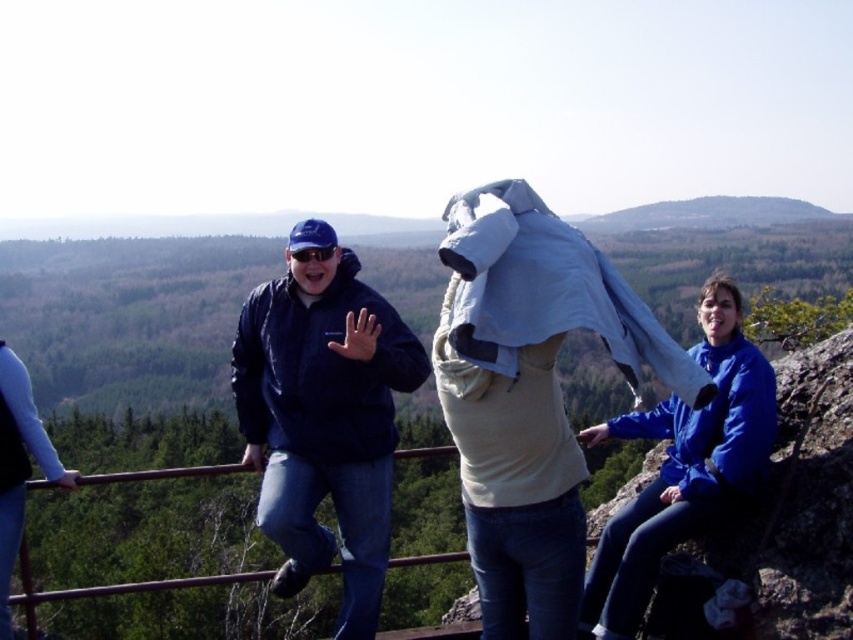
Question: Is matte blue jacket at center thinner than blue fleece jacket at upper right?

Choices:
 (A) yes
 (B) no

Answer: (B)

Question: Among these points, which one is farthest from the camera?

Choices:
 (A) (345, 497)
 (B) (611, 516)

Answer: (A)

Question: Is matte blue jacket at center to the right of blue fleece jacket at upper right from the viewer's perspective?

Choices:
 (A) yes
 (B) no

Answer: (B)

Question: Does matte blue jacket at center appear on the left side of blue fleece jacket at upper right?

Choices:
 (A) yes
 (B) no

Answer: (A)

Question: Which object appears farthest from the camera in this image?

Choices:
 (A) blue fleece jacket at upper right
 (B) matte blue jacket at center

Answer: (B)